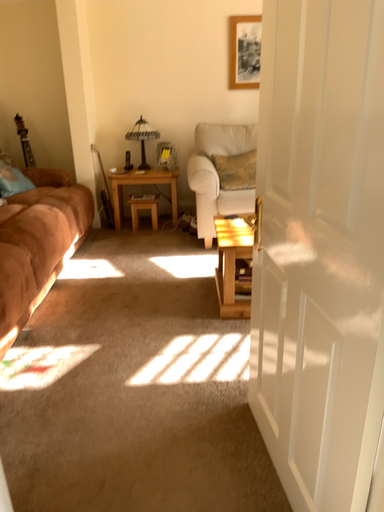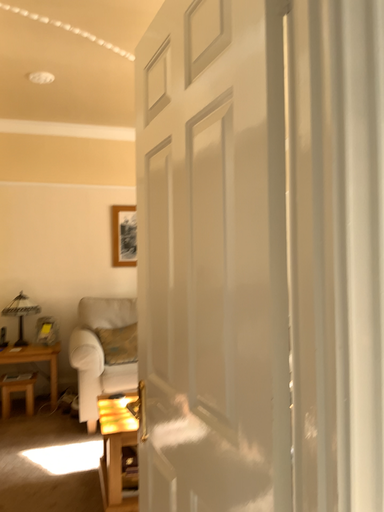
Question: Which way did the camera rotate in the video?

Choices:
 (A) rotated downward
 (B) rotated upward

Answer: (B)